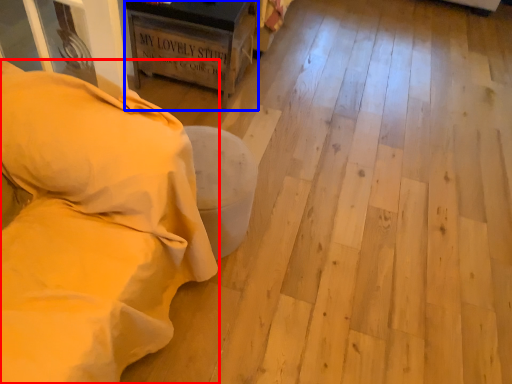
Question: Among these objects, which one is nearest to the camera, furniture (highlighted by a red box) or furniture (highlighted by a blue box)?

Choices:
 (A) furniture
 (B) furniture

Answer: (A)